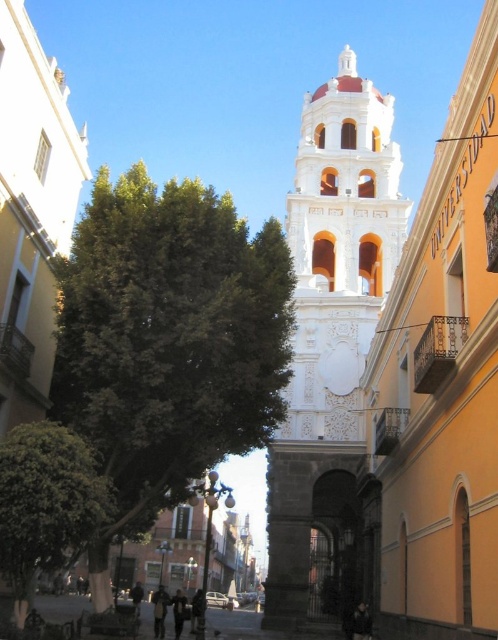
Question: In this image, where is white ornate tower at center located relative to white marble church at center?

Choices:
 (A) below
 (B) above

Answer: (A)

Question: Is green leafy tree at left below dark gray jacket at center?

Choices:
 (A) no
 (B) yes

Answer: (A)

Question: Among these objects, which one is farthest from the camera?

Choices:
 (A) white marble church at center
 (B) green leafy tree at center

Answer: (A)

Question: Does dark blue jeans at lower center come behind dark gray fabric at center?

Choices:
 (A) no
 (B) yes

Answer: (A)

Question: Among these points, which one is nearest to the camera?

Choices:
 (A) (279, 296)
 (B) (4, 102)
 (C) (137, 609)
 (D) (180, 609)

Answer: (B)

Question: Which point is farther to the camera?

Choices:
 (A) (198, 593)
 (B) (162, 618)
 (C) (34, 445)
 (D) (491, 394)

Answer: (A)